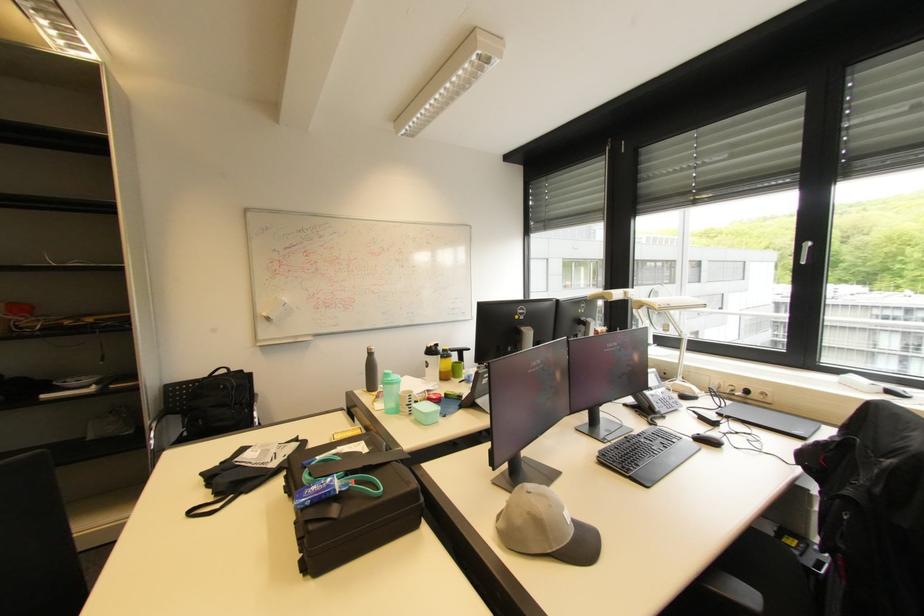
This screenshot has width=924, height=616. Describe the element at coordinates (332, 484) in the screenshot. I see `a green case handle` at that location.